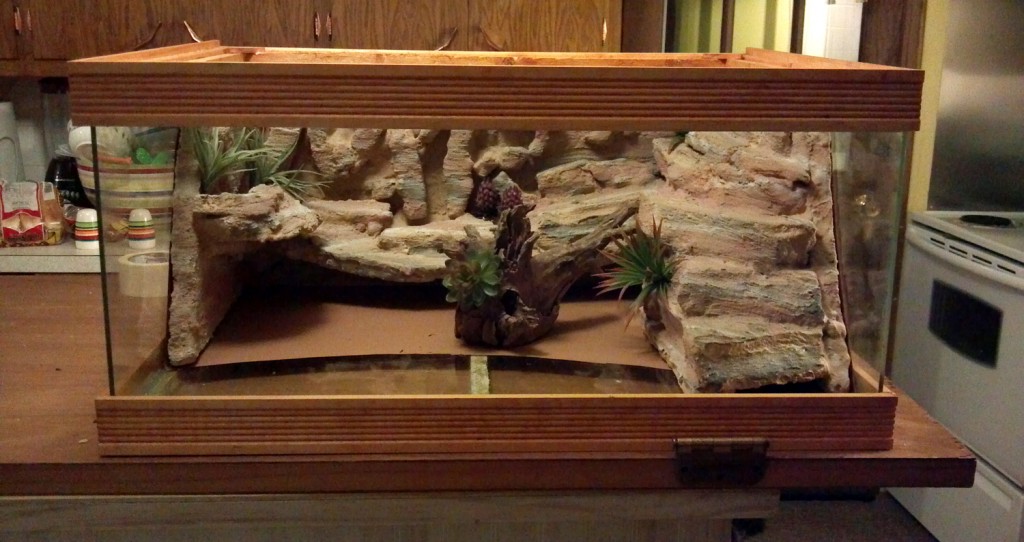
At what (x,y) coordinates should I click in order to perform the action: click on wood cabinets. Please return your answer as a coordinate pair (x, y). Looking at the image, I should click on (19, 38), (100, 18), (259, 14), (396, 27), (501, 38).